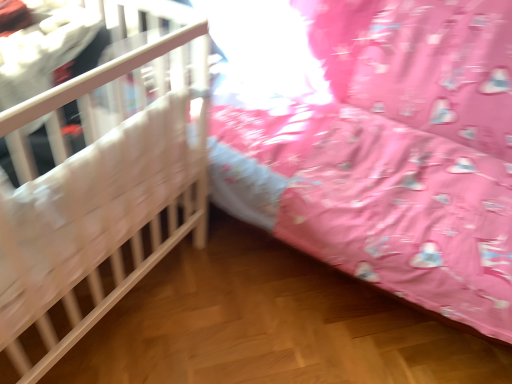
Find the location of a particular element. white wooden crib at left, positioned as the first infant bed in left-to-right order is located at coordinates (104, 189).

In order to face white wooden crib at left, positioned as the first infant bed in left-to-right order, should I rotate leftwards or rightwards?

Rotate your view left by about 27.929°.

What do you see at coordinates (104, 189) in the screenshot? I see `white wooden crib at left, positioned as the first infant bed in left-to-right order` at bounding box center [104, 189].

At what (x,y) coordinates should I click in order to perform the action: click on wooden crib at left, the 1th infant bed from the right. Please return your answer as a coordinate pair (x, y). The image size is (512, 384). Looking at the image, I should click on (376, 141).

Measure the distance between wooden crib at left, the 1th infant bed from the right, and camera.

They are 3.50 feet apart.

What do you see at coordinates (376, 141) in the screenshot?
I see `wooden crib at left, which is the 2th infant bed from left to right` at bounding box center [376, 141].

Where is `white wooden crib at left, positioned as the first infant bed in left-to-right order`? This screenshot has width=512, height=384. white wooden crib at left, positioned as the first infant bed in left-to-right order is located at coordinates (104, 189).

Does white wooden crib at left, positioned as the first infant bed in left-to-right order, appear on the right side of wooden crib at left, the 1th infant bed from the right?

No.

Which is in front, white wooden crib at left, positioned as the first infant bed in left-to-right order, or wooden crib at left, which is the 2th infant bed from left to right?

white wooden crib at left, positioned as the first infant bed in left-to-right order, is closer to the camera.

Is point (20, 322) closer to camera compared to point (308, 50)?

Yes, it is.

Looking at this image, from the image's perspective, which object appears higher, white wooden crib at left, which is the second infant bed from right to left, or wooden crib at left, which is the 2th infant bed from left to right?

wooden crib at left, which is the 2th infant bed from left to right, appears higher in the image.

From a real-world perspective, is white wooden crib at left, positioned as the first infant bed in left-to-right order, positioned above or below wooden crib at left, which is the 2th infant bed from left to right?

white wooden crib at left, positioned as the first infant bed in left-to-right order, is situated lower than wooden crib at left, which is the 2th infant bed from left to right, in the real world.

In terms of width, does white wooden crib at left, which is the second infant bed from right to left, look wider or thinner when compared to wooden crib at left, the 1th infant bed from the right?

Clearly, white wooden crib at left, which is the second infant bed from right to left, has less width compared to wooden crib at left, the 1th infant bed from the right.

Between white wooden crib at left, positioned as the first infant bed in left-to-right order, and wooden crib at left, the 1th infant bed from the right, which one has more height?

With more height is wooden crib at left, the 1th infant bed from the right.

Considering the sizes of objects white wooden crib at left, which is the second infant bed from right to left, and wooden crib at left, which is the 2th infant bed from left to right, in the image provided, who is bigger, white wooden crib at left, which is the second infant bed from right to left, or wooden crib at left, which is the 2th infant bed from left to right,?

wooden crib at left, which is the 2th infant bed from left to right.

Is white wooden crib at left, positioned as the first infant bed in left-to-right order, completely or partially outside of wooden crib at left, the 1th infant bed from the right?

Yes, white wooden crib at left, positioned as the first infant bed in left-to-right order, is outside of wooden crib at left, the 1th infant bed from the right.

Based on the photo, is the surface of white wooden crib at left, which is the second infant bed from right to left, in direct contact with wooden crib at left, which is the 2th infant bed from left to right?

There is a gap between white wooden crib at left, which is the second infant bed from right to left, and wooden crib at left, which is the 2th infant bed from left to right.

Consider the image. Could you tell me if white wooden crib at left, which is the second infant bed from right to left, is turned towards wooden crib at left, the 1th infant bed from the right?

No.

What's the angular difference between white wooden crib at left, which is the second infant bed from right to left, and wooden crib at left, which is the 2th infant bed from left to right,'s facing directions?

white wooden crib at left, which is the second infant bed from right to left, and wooden crib at left, which is the 2th infant bed from left to right, are facing 90.3 degrees away from each other.

How much distance is there between white wooden crib at left, which is the second infant bed from right to left, and wooden crib at left, the 1th infant bed from the right?

white wooden crib at left, which is the second infant bed from right to left, and wooden crib at left, the 1th infant bed from the right, are 19.77 inches apart.

Image resolution: width=512 pixels, height=384 pixels. Find the location of `infant bed that is under the wooden crib at left, the 1th infant bed from the right (from a real-world perspective)`. infant bed that is under the wooden crib at left, the 1th infant bed from the right (from a real-world perspective) is located at coordinates (104, 189).

In the image, is wooden crib at left, which is the 2th infant bed from left to right, on the left side or the right side of white wooden crib at left, which is the second infant bed from right to left?

From the image, it's evident that wooden crib at left, which is the 2th infant bed from left to right, is to the right of white wooden crib at left, which is the second infant bed from right to left.

Is wooden crib at left, the 1th infant bed from the right, further to camera compared to white wooden crib at left, which is the second infant bed from right to left?

Yes, it is.

Which point is more distant from viewer, (276, 27) or (146, 2)?

Positioned behind is point (276, 27).

Based on the photo, from the image's perspective, is wooden crib at left, the 1th infant bed from the right, over white wooden crib at left, positioned as the first infant bed in left-to-right order?

Yes, from the image's perspective, wooden crib at left, the 1th infant bed from the right, is on top of white wooden crib at left, positioned as the first infant bed in left-to-right order.

From a real-world perspective, between wooden crib at left, which is the 2th infant bed from left to right, and white wooden crib at left, which is the second infant bed from right to left, who is vertically lower?

white wooden crib at left, which is the second infant bed from right to left.

Can you confirm if wooden crib at left, the 1th infant bed from the right, is wider than white wooden crib at left, positioned as the first infant bed in left-to-right order?

Correct, the width of wooden crib at left, the 1th infant bed from the right, exceeds that of white wooden crib at left, positioned as the first infant bed in left-to-right order.

Which of these two, wooden crib at left, the 1th infant bed from the right, or white wooden crib at left, positioned as the first infant bed in left-to-right order, stands taller?

wooden crib at left, the 1th infant bed from the right, is taller.

Between wooden crib at left, the 1th infant bed from the right, and white wooden crib at left, positioned as the first infant bed in left-to-right order, which one has larger size?

Bigger between the two is wooden crib at left, the 1th infant bed from the right.

Looking at this image, which is correct: wooden crib at left, which is the 2th infant bed from left to right, is inside white wooden crib at left, positioned as the first infant bed in left-to-right order, or outside of it?

wooden crib at left, which is the 2th infant bed from left to right, is located beyond the bounds of white wooden crib at left, positioned as the first infant bed in left-to-right order.

Is wooden crib at left, which is the 2th infant bed from left to right, not near white wooden crib at left, positioned as the first infant bed in left-to-right order?

No, wooden crib at left, which is the 2th infant bed from left to right, is not far from white wooden crib at left, positioned as the first infant bed in left-to-right order.

Is wooden crib at left, the 1th infant bed from the right, turned away from white wooden crib at left, positioned as the first infant bed in left-to-right order?

No, wooden crib at left, the 1th infant bed from the right, is not facing the opposite direction of white wooden crib at left, positioned as the first infant bed in left-to-right order.

How different are the orientations of wooden crib at left, which is the 2th infant bed from left to right, and white wooden crib at left, which is the second infant bed from right to left, in degrees?

The angle between the facing direction of wooden crib at left, which is the 2th infant bed from left to right, and the facing direction of white wooden crib at left, which is the second infant bed from right to left, is 90.3 degrees.

In the image, there is a white wooden crib at left, positioned as the first infant bed in left-to-right order. Identify the location of infant bed above it (from the image's perspective). This screenshot has height=384, width=512. (376, 141).

You are a GUI agent. You are given a task and a screenshot of the screen. Output one action in this format:
    pyautogui.click(x=<x>, y=<y>)
    Task: Click on the infant bed in front of the wooden crib at left, which is the 2th infant bed from left to right
    
    Given the screenshot: What is the action you would take?
    (104, 189)

Find the location of a particular element. The width and height of the screenshot is (512, 384). infant bed that appears below the wooden crib at left, which is the 2th infant bed from left to right (from the image's perspective) is located at coordinates (104, 189).